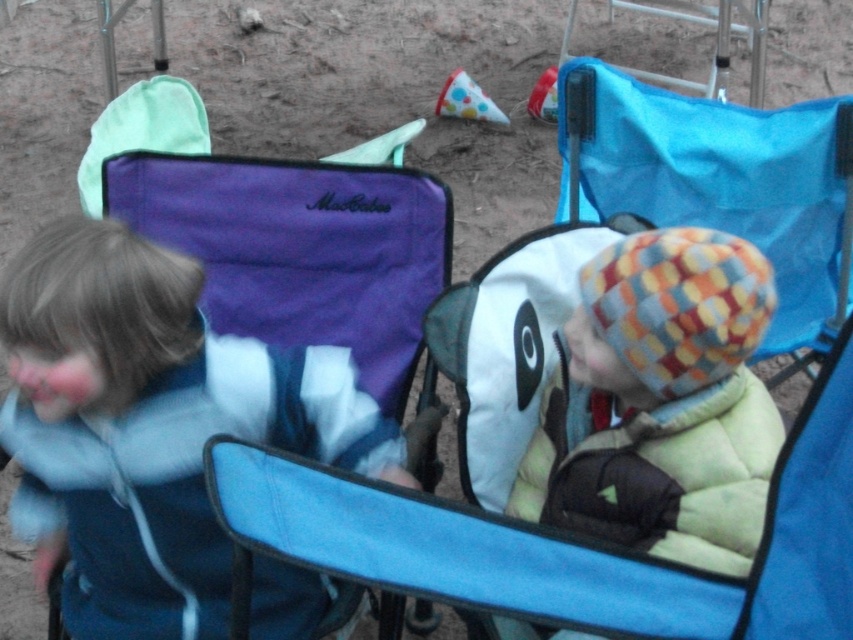
Question: Among these points, which one is farthest from the camera?

Choices:
 (A) (698, 316)
 (B) (601, 212)

Answer: (B)

Question: Is white fabric baby carriage at center further to the viewer compared to matte blue jacket at left?

Choices:
 (A) no
 (B) yes

Answer: (A)

Question: Does white fabric baby carriage at center appear on the right side of blue fabric folding chair at center?

Choices:
 (A) yes
 (B) no

Answer: (B)

Question: Is white fabric baby carriage at center wider than matte blue jacket at left?

Choices:
 (A) no
 (B) yes

Answer: (B)

Question: Which of these objects is positioned closest to the blue fabric folding chair at center?

Choices:
 (A) white fabric baby carriage at center
 (B) matte blue jacket at left
 (C) woolen checkered hat at center

Answer: (C)

Question: Which of the following is the farthest from the observer?

Choices:
 (A) woolen checkered hat at center
 (B) blue fabric folding chair at center

Answer: (B)